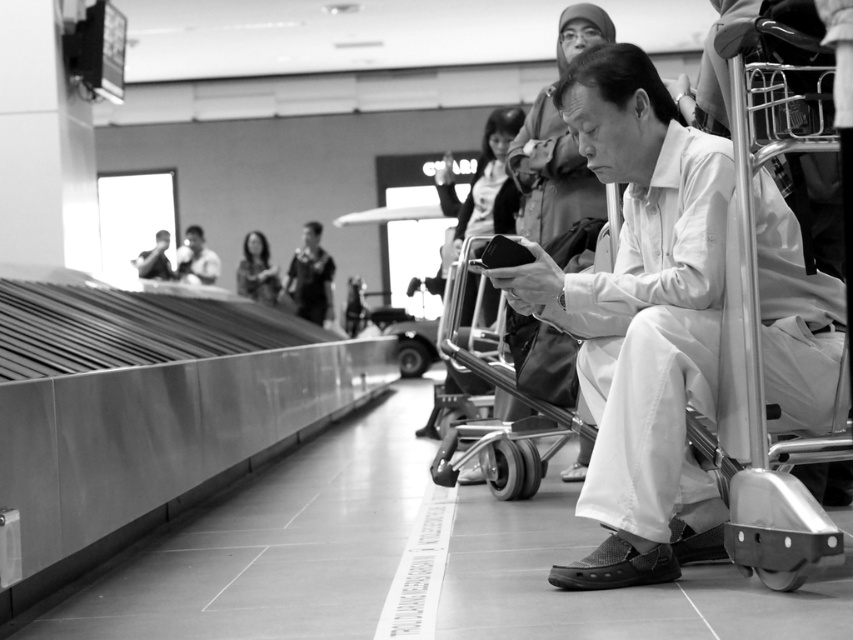
In the airport baggage claim area, you notice a smooth fabric jacket at center and a smooth skin face at upper left. Which object is positioned to the right of the other?

The smooth fabric jacket at center is positioned to the right of the smooth skin face at upper left.